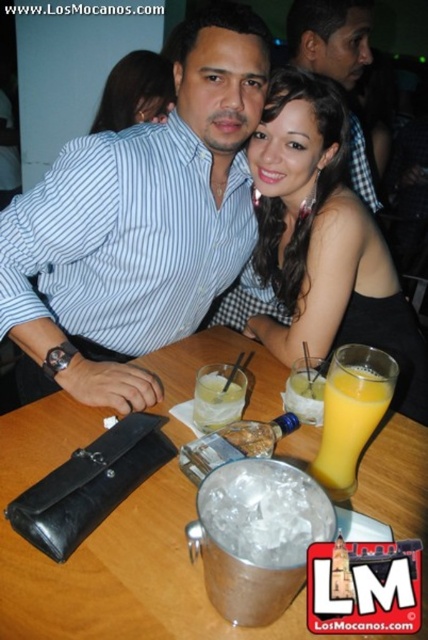
Question: Which of the following is the closest to the observer?

Choices:
 (A) (136, 392)
 (B) (371, 188)

Answer: (A)

Question: Is shiny black dress at center below clear glass at table center?

Choices:
 (A) yes
 (B) no

Answer: (B)

Question: Is shiny black dress at center smaller than matte black shirt at center?

Choices:
 (A) no
 (B) yes

Answer: (A)

Question: Which object is the closest to the shiny black dress at center?

Choices:
 (A) ice-filled metal bucket at table center
 (B) yellow translucent glass at table center

Answer: (B)

Question: Which of the following is the farthest from the observer?

Choices:
 (A) (177, 422)
 (B) (124, 72)
 (C) (275, 573)
 (D) (323, 481)

Answer: (B)

Question: Is shiny black dress at center below orange liquid at table center?

Choices:
 (A) yes
 (B) no

Answer: (B)